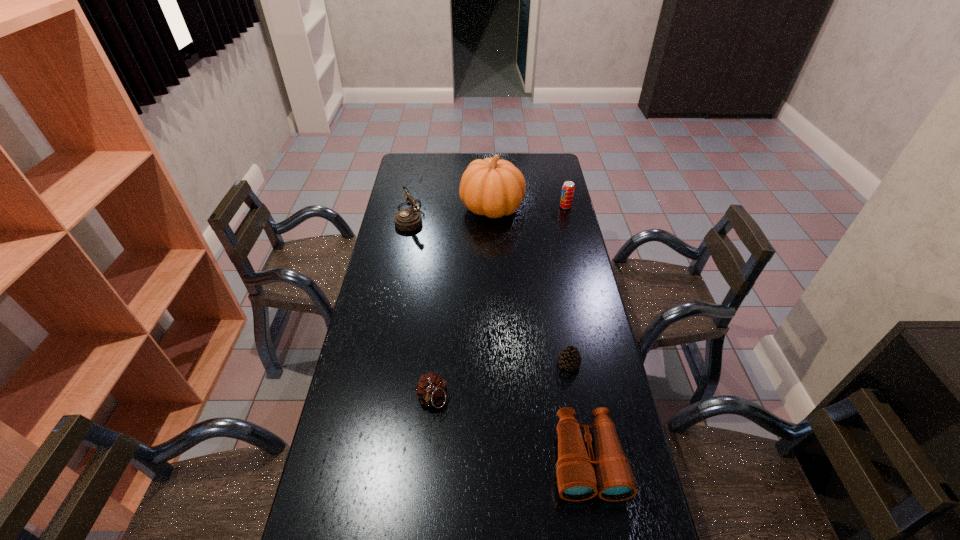
Where is `vacant space at the left edge of the desktop`? vacant space at the left edge of the desktop is located at coordinates (385, 246).

The height and width of the screenshot is (540, 960). What are the coordinates of `vacant space at the right edge of the desktop` in the screenshot? It's located at (553, 237).

At what (x,y) coordinates should I click in order to perform the action: click on empty space that is in between the tallest object and the farther pinecone. Please return your answer as a coordinate pair (x, y). Looking at the image, I should click on (531, 286).

Where is `free space between the left pinecone and the shorter pinecone`? free space between the left pinecone and the shorter pinecone is located at coordinates (500, 381).

Find the location of a particular element. The height and width of the screenshot is (540, 960). unoccupied position between the leftmost object and the fifth farthest object is located at coordinates (421, 307).

Where is `vacant point located between the nearest object and the telephone`? The width and height of the screenshot is (960, 540). vacant point located between the nearest object and the telephone is located at coordinates (498, 337).

The image size is (960, 540). Find the location of `free spot between the binoculars and the leftmost object`. free spot between the binoculars and the leftmost object is located at coordinates (498, 337).

Where is `vacant area between the nearest object and the nearer pinecone`? This screenshot has width=960, height=540. vacant area between the nearest object and the nearer pinecone is located at coordinates (510, 429).

What are the coordinates of `free spot between the third nearest object and the left pinecone` in the screenshot? It's located at (500, 381).

Where is `free area in between the shorter pinecone and the telephone`? The height and width of the screenshot is (540, 960). free area in between the shorter pinecone and the telephone is located at coordinates (490, 289).